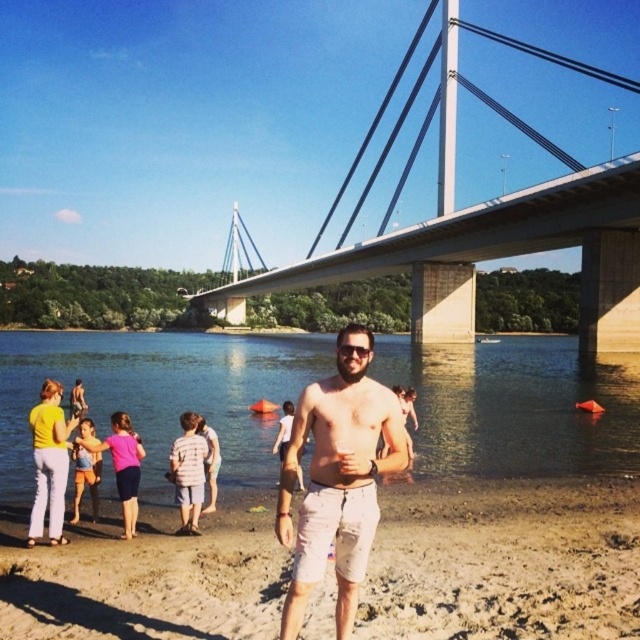
Question: Which object is the closest to the metallic gray suspension bridge at upper center?

Choices:
 (A) beige cotton shorts at center
 (B) brown sandy beach at center
 (C) yellow cotton shirt at lower left
 (D) pink fabric dress at lower left

Answer: (B)

Question: Does brown sandy beach at center have a greater width compared to blue water at lower center?

Choices:
 (A) no
 (B) yes

Answer: (A)

Question: Which of these objects is positioned closest to the blue denim shorts at lower left?

Choices:
 (A) pink fabric dress at lower left
 (B) light blue denim shorts at lower left
 (C) blue water at lower center
 (D) brown sandy beach at center

Answer: (A)

Question: Does blue water at lower center have a greater width compared to pink fabric shorts at lower center?

Choices:
 (A) no
 (B) yes

Answer: (B)

Question: Does beige cotton shorts at center have a smaller size compared to pink fabric shorts at lower center?

Choices:
 (A) no
 (B) yes

Answer: (A)

Question: Which point is closer to the camera?

Choices:
 (A) click(x=196, y=432)
 (B) click(x=337, y=604)
 (C) click(x=81, y=403)

Answer: (B)